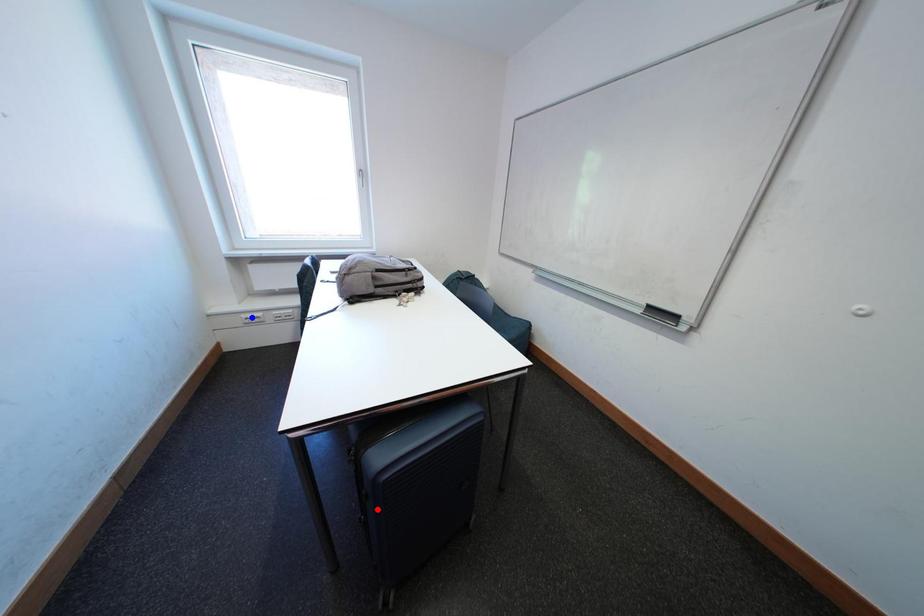
Question: Which of the two points in the image is closer to the camera?

Choices:
 (A) Blue point is closer.
 (B) Red point is closer.

Answer: (B)